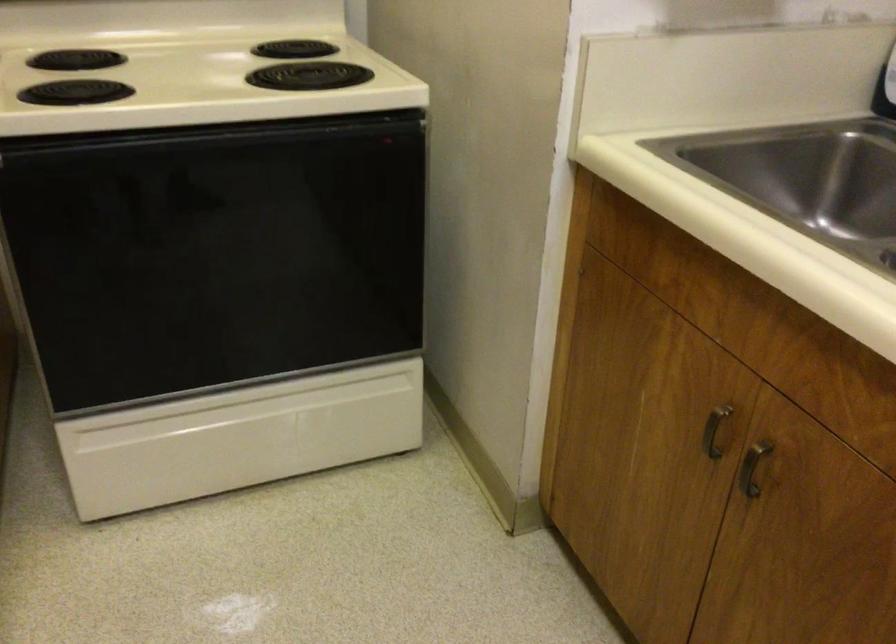
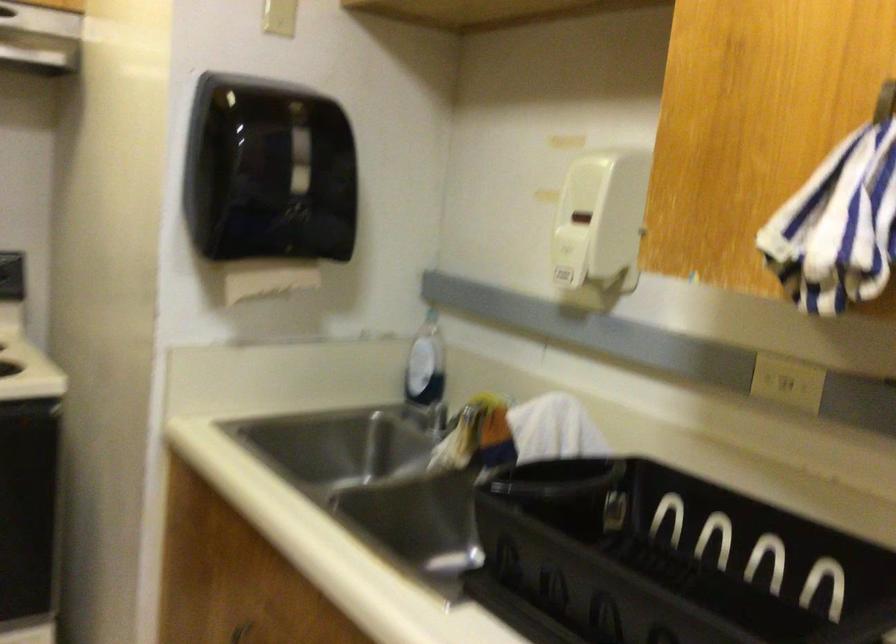
What movement of the cameraman would produce the second image?

The movement direction of the cameraman is right, backward.